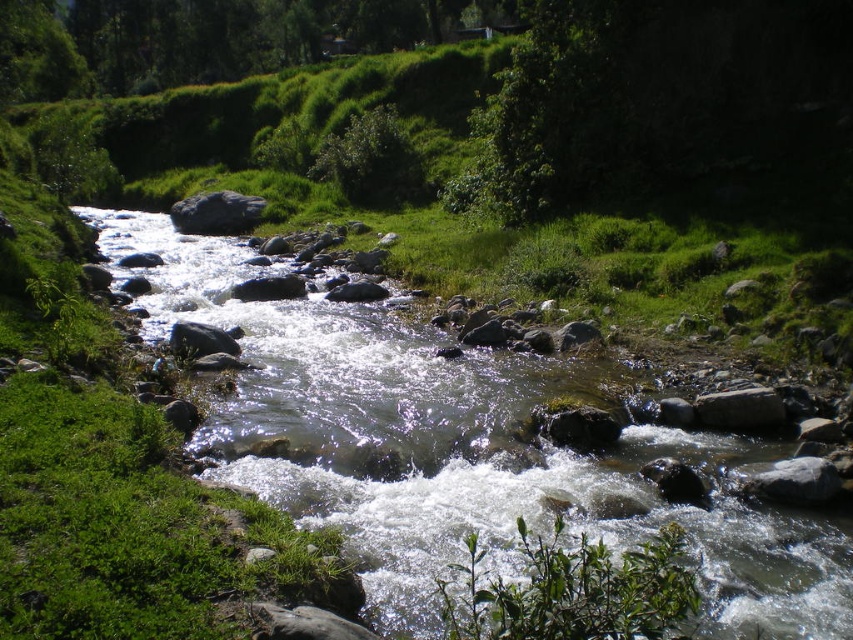
Which is more to the left, clear water at center or gray smooth rock at center?

gray smooth rock at center

Is clear water at center taller than gray smooth rock at center?

Correct, clear water at center is much taller as gray smooth rock at center.

Is point (770, 620) farther from viewer compared to point (207, 234)?

No, (770, 620) is closer to viewer.

This screenshot has width=853, height=640. I want to click on clear water at center, so click(462, 449).

Between green leafy tree at upper center and gray smooth rock at center, which one has more height?

green leafy tree at upper center

From the picture: Which is above, green leafy tree at upper center or gray smooth rock at center?

Positioned higher is green leafy tree at upper center.

Is point (389, 51) more distant than point (184, 202)?

Yes, it is.

You are a GUI agent. You are given a task and a screenshot of the screen. Output one action in this format:
    pyautogui.click(x=<x>, y=<y>)
    Task: Click on the green leafy tree at upper center
    The width and height of the screenshot is (853, 640).
    Given the screenshot: What is the action you would take?
    pyautogui.click(x=206, y=38)

Is clear water at center bigger than green leafy tree at upper center?

Incorrect, clear water at center is not larger than green leafy tree at upper center.

Is clear water at center positioned behind green leafy tree at upper center?

No, clear water at center is in front of green leafy tree at upper center.

Locate an element on the screen. The image size is (853, 640). clear water at center is located at coordinates (462, 449).